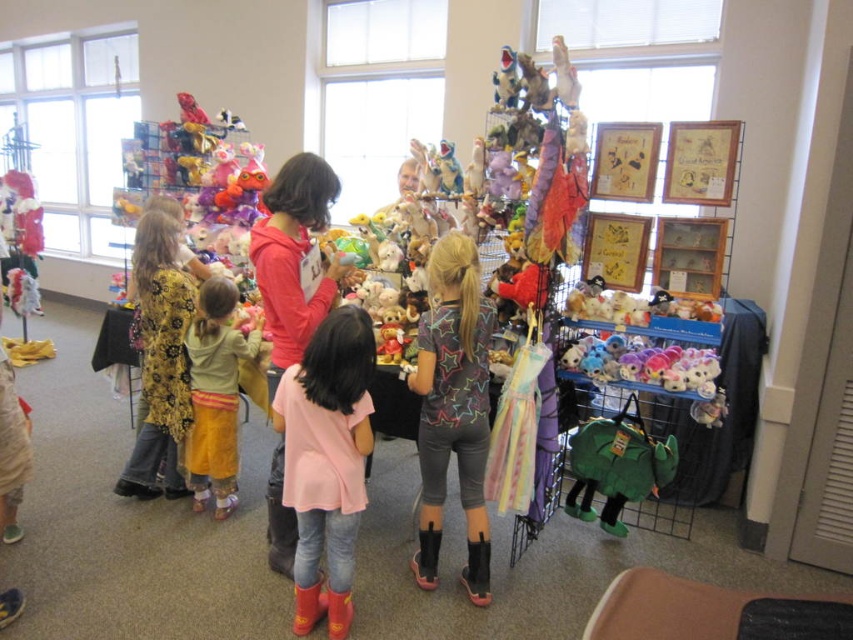
Which is below, pink fabric shirt at center or green fabric backpack at lower right?

green fabric backpack at lower right

Is pink fabric shirt at center to the right of green fabric backpack at lower right from the viewer's perspective?

Incorrect, pink fabric shirt at center is not on the right side of green fabric backpack at lower right.

Is point (287, 378) less distant than point (581, 429)?

That is True.

I want to click on pink fabric shirt at center, so click(326, 461).

Does gray matte leggings at center have a greater height compared to green fabric backpack at lower right?

Indeed, gray matte leggings at center has a greater height compared to green fabric backpack at lower right.

Is gray matte leggings at center smaller than green fabric backpack at lower right?

Actually, gray matte leggings at center might be larger than green fabric backpack at lower right.

This screenshot has height=640, width=853. What do you see at coordinates (453, 408) in the screenshot?
I see `gray matte leggings at center` at bounding box center [453, 408].

Locate an element on the screen. The width and height of the screenshot is (853, 640). gray matte leggings at center is located at coordinates (453, 408).

Which is more to the left, pink fabric shirt at center or gray matte leggings at center?

Positioned to the left is pink fabric shirt at center.

Does pink fabric shirt at center appear on the left side of gray matte leggings at center?

Correct, you'll find pink fabric shirt at center to the left of gray matte leggings at center.

Where is `pink fabric shirt at center`? This screenshot has height=640, width=853. pink fabric shirt at center is located at coordinates (326, 461).